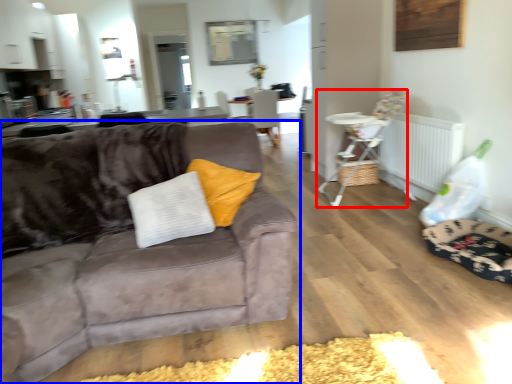
Question: Which of the following is the closest to the observer, chair (highlighted by a red box) or studio couch (highlighted by a blue box)?

Choices:
 (A) chair
 (B) studio couch

Answer: (B)